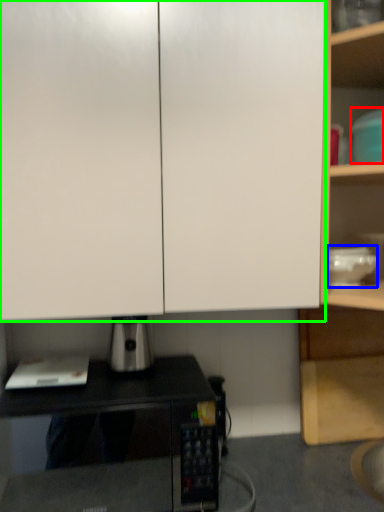
Question: Which is farther away from appliance (highlighted by a red box)? appliance (highlighted by a blue box) or cabinetry (highlighted by a green box)?

Choices:
 (A) appliance
 (B) cabinetry

Answer: (B)